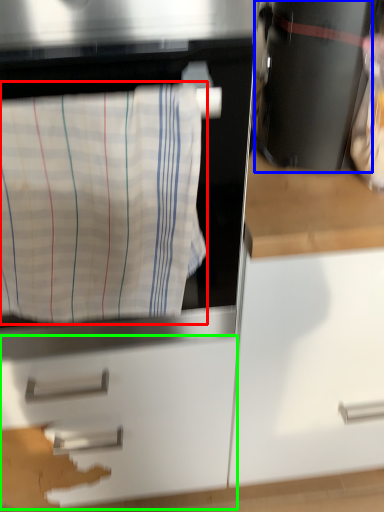
Question: Which object is the farthest from laundry (highlighted by a red box)? Choose among these: appliance (highlighted by a blue box) or drawer (highlighted by a green box).

Choices:
 (A) appliance
 (B) drawer

Answer: (B)